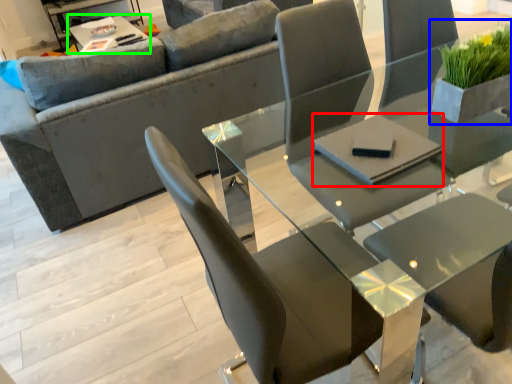
Question: Which object is the farthest from pad (highlighted by a red box)? Choose among these: houseplant (highlighted by a blue box) or table (highlighted by a green box).

Choices:
 (A) houseplant
 (B) table

Answer: (B)